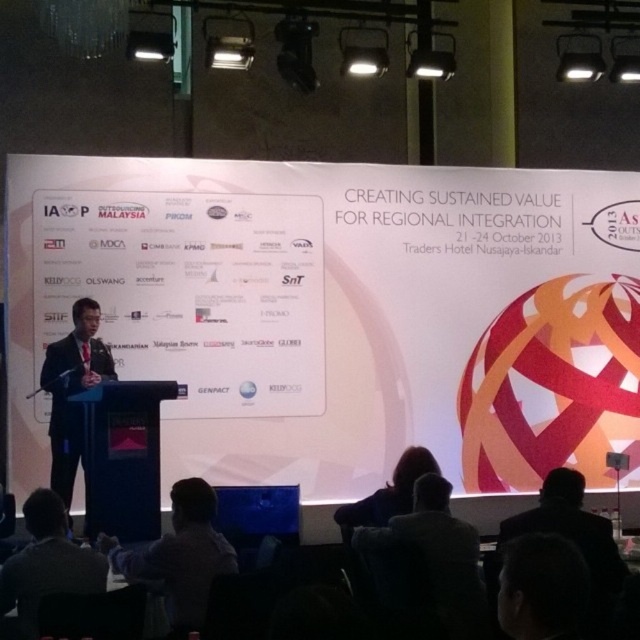
Question: Observing the image, what is the correct spatial positioning of dark gray suit at lower left in reference to black suit at left?

Choices:
 (A) below
 (B) above

Answer: (A)

Question: Which of the following is the farthest from the observer?

Choices:
 (A) (54, 554)
 (B) (102, 371)

Answer: (B)

Question: Where is dark gray suit at lower left located in relation to black suit at left in the image?

Choices:
 (A) above
 (B) below

Answer: (B)

Question: Is dark gray suit at lower left positioned behind black suit at left?

Choices:
 (A) yes
 (B) no

Answer: (B)

Question: Which point is farther from the camera taking this photo?

Choices:
 (A) (65, 339)
 (B) (68, 561)

Answer: (A)